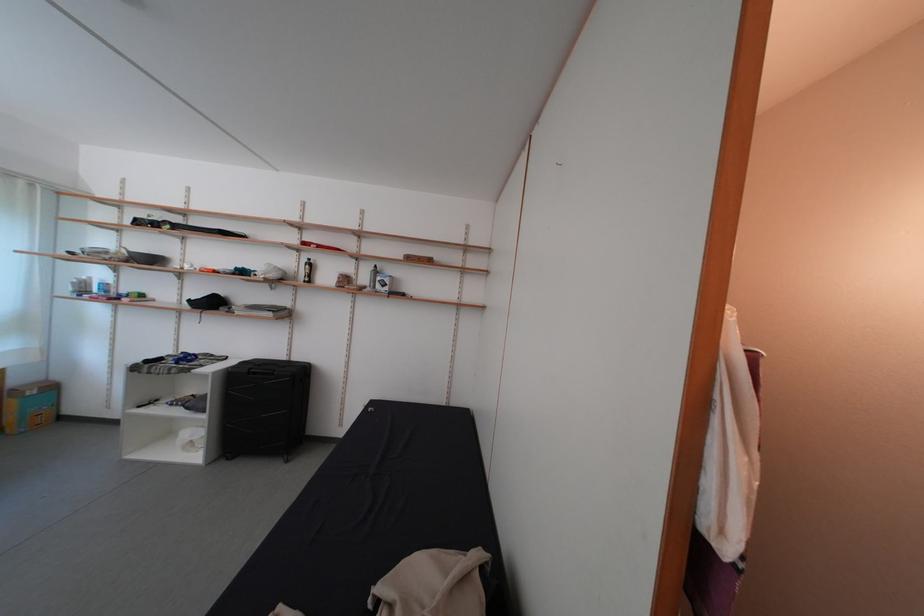
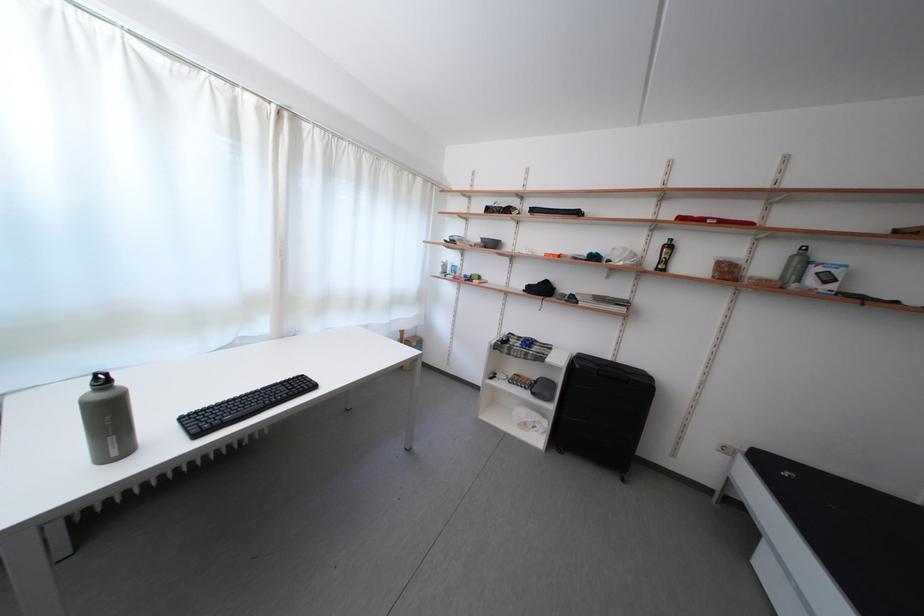
The point at (382, 274) is marked in the first image. Where is the corresponding point in the second image?

(804, 257)